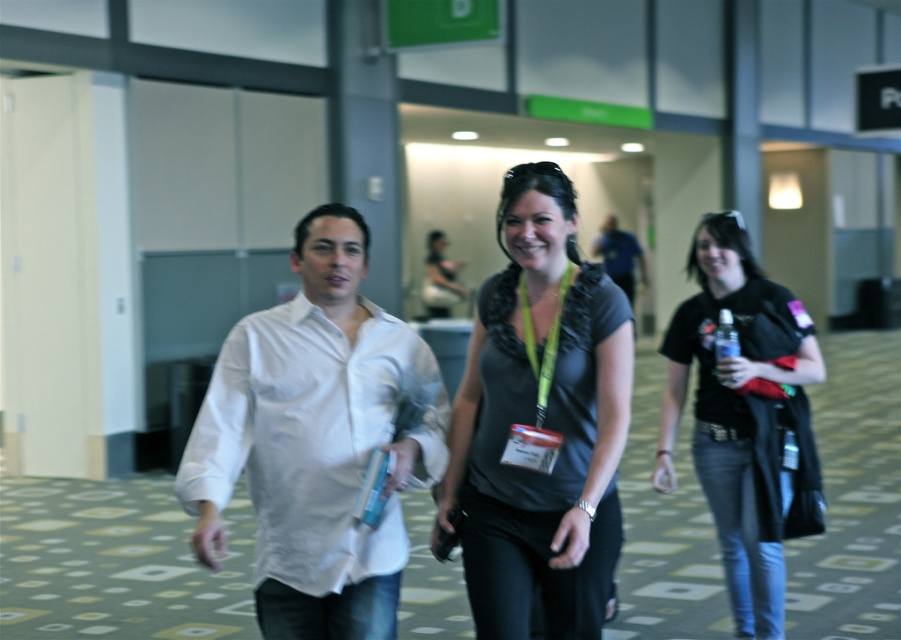
You are standing in the convention center and see the black matte shirt at right and the yellow fabric lanyard at center. Which object is wider?

The black matte shirt at right might be wider than yellow fabric lanyard at center.

You are standing in the convention center and see two points marked on the floor. The first point is at coordinate point (361,339) and the second is at point (752,621). Which point is closer to you?

Point (361,339) is closer to the viewer than point (752,621).